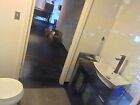
In order to click on open door in this screenshot , I will do `click(29, 30)`.